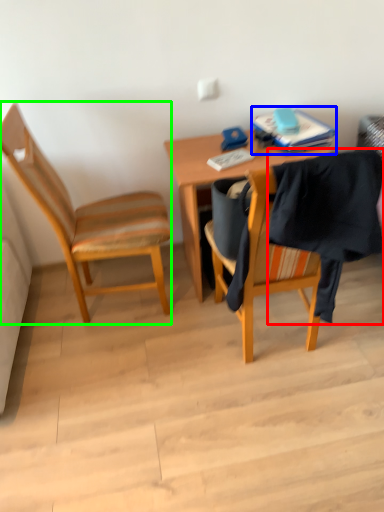
Question: Which is nearer to the clothe (highlighted by a red box)? book (highlighted by a blue box) or chair (highlighted by a green box).

Choices:
 (A) book
 (B) chair

Answer: (A)